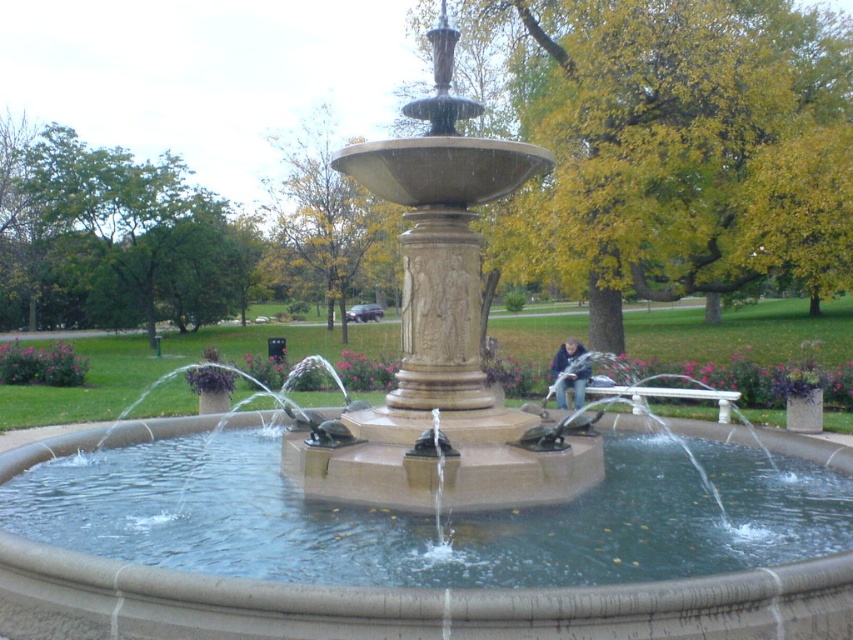
You are standing at the entrance of the park and want to sit on the white marble bench at lower right. According to the park layout, where should you head to find it?

The white marble bench at lower right is located at point (x=663, y=396), so you should head towards the lower right direction from the entrance to find it.

You are a person sitting on the white marble bench at lower right and want to pick up the blue denim jacket at center. Which direction should you move to reach it?

The white marble bench at lower right is positioned on the right side of the blue denim jacket at center, so you should move to your left to reach it.

You are a person who is 5 feet tall and want to sit on the white marble bench at lower right. You are currently standing next to the blue denim jacket at center. Can you reach the bench without needing to stretch too far?

The distance between the white marble bench at lower right and the blue denim jacket at center is 4.60 feet. Since you are 5 feet tall, you can comfortably reach the bench without stretching too far as the distance is within a reasonable range for someone of your height.